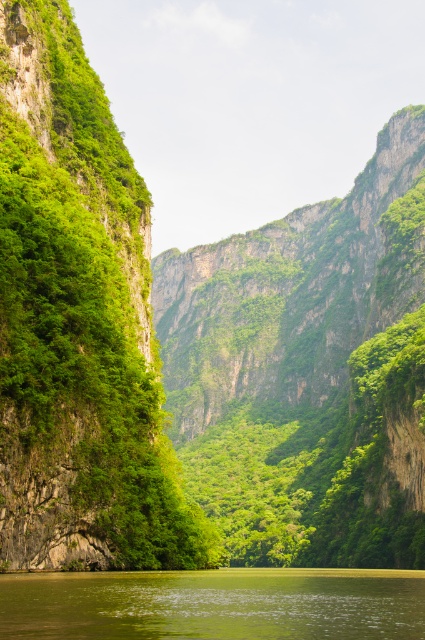
Question: Can you confirm if green leafy vegetation at left is positioned to the left of green liquid water at center?

Choices:
 (A) yes
 (B) no

Answer: (A)

Question: Can you confirm if green leafy vegetation at left is wider than green liquid water at center?

Choices:
 (A) no
 (B) yes

Answer: (A)

Question: Can you confirm if green leafy vegetation at left is positioned above green liquid water at center?

Choices:
 (A) yes
 (B) no

Answer: (A)

Question: Which object appears farthest from the camera in this image?

Choices:
 (A) green leafy vegetation at left
 (B) green liquid water at center

Answer: (A)

Question: Which of the following is the closest to the observer?

Choices:
 (A) (277, 580)
 (B) (70, 252)

Answer: (B)